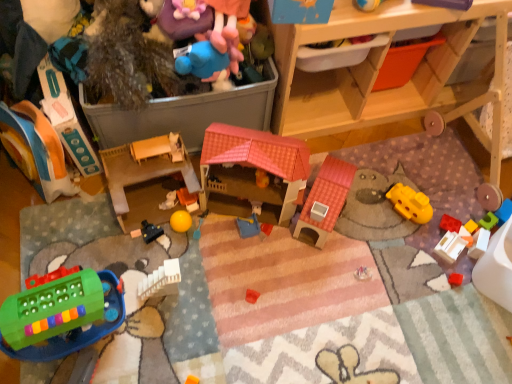
Image resolution: width=512 pixels, height=384 pixels. I want to click on free spot to the left of yellow rubber ball at center, arranged as the 8th toy when viewed from the right, so click(124, 226).